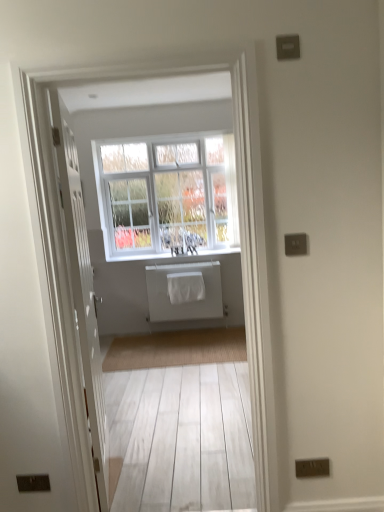
Question: Looking at the image, does white matte radiator at center seem bigger or smaller compared to white textured window at center?

Choices:
 (A) small
 (B) big

Answer: (A)

Question: In the image, is white matte radiator at center on the left side or the right side of white textured window at center?

Choices:
 (A) right
 (B) left

Answer: (A)

Question: Considering the real-world distances, which object is closest to the white matte radiator at center?

Choices:
 (A) white textured window at center
 (B) white painted wood at center
 (C) white wooden door at center

Answer: (B)

Question: Which is nearer to the white textured window at center?

Choices:
 (A) white matte radiator at center
 (B) white wooden door at center
 (C) white painted wood at center

Answer: (C)